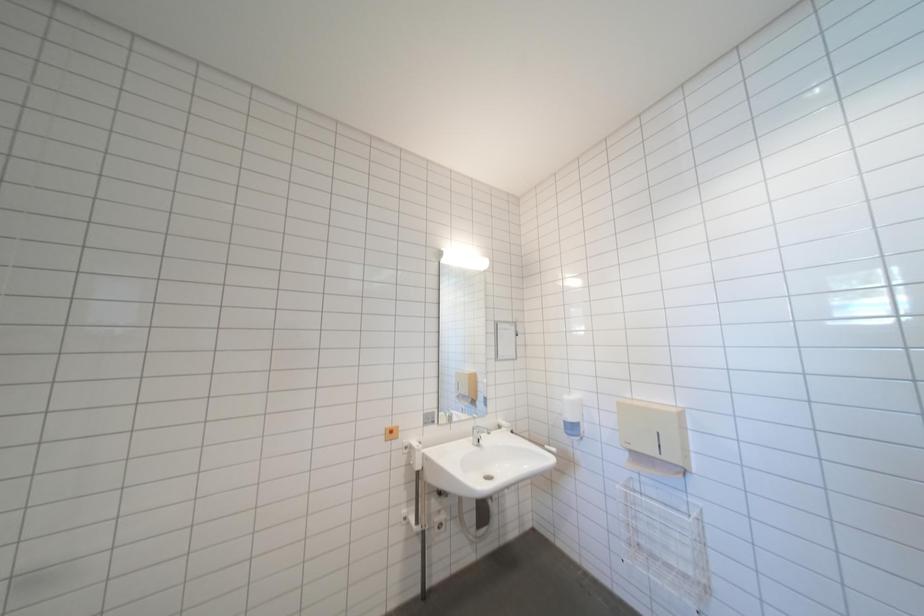
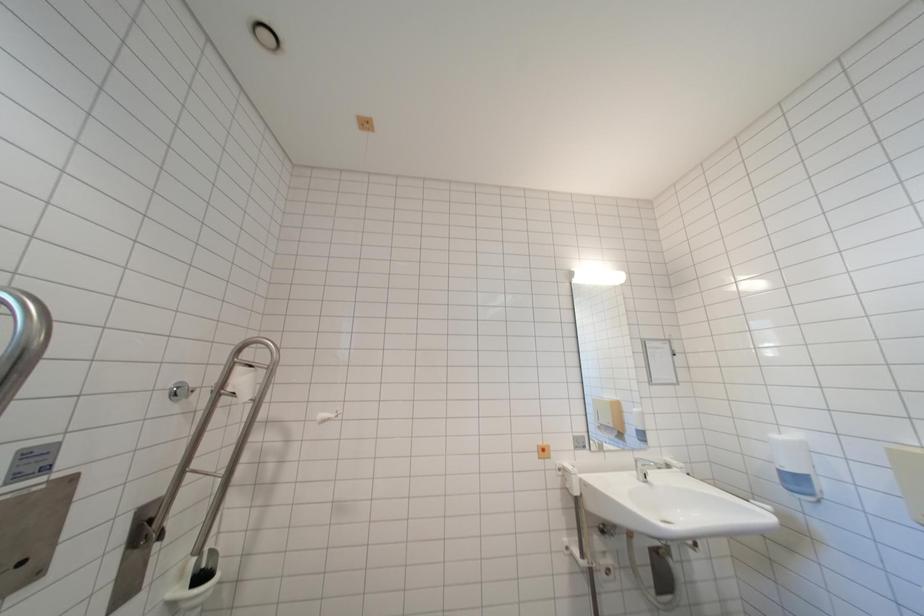
Question: The camera is either moving clockwise (left) or counter-clockwise (right) around the object. The first image is from the beginning of the video and the second image is from the end. Is the camera moving left or right when shooting the video?

Choices:
 (A) Left
 (B) Right

Answer: (B)